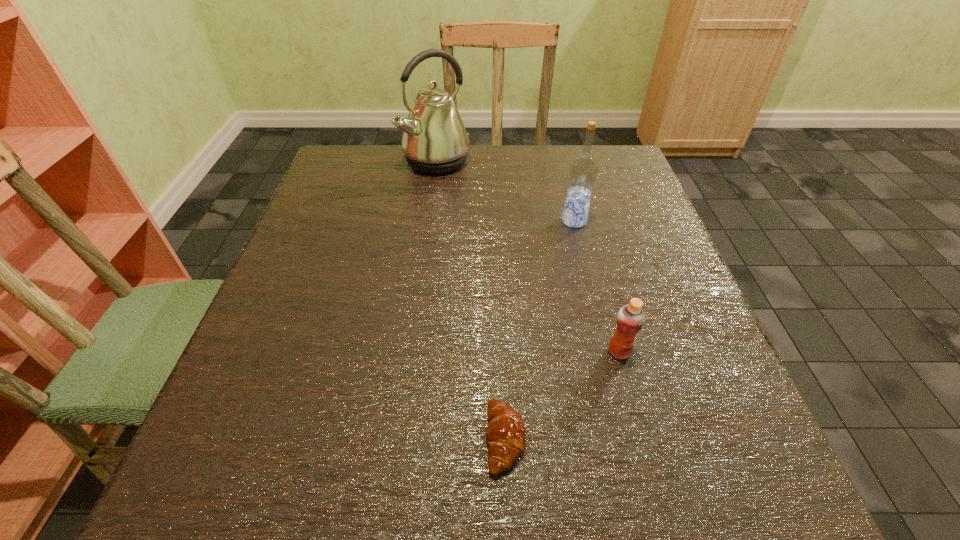
At what (x,y) coordinates should I click in order to perform the action: click on the tallest object. Please return your answer as a coordinate pair (x, y). The height and width of the screenshot is (540, 960). Looking at the image, I should click on (435, 141).

Identify the location of the farthest object. The height and width of the screenshot is (540, 960). (435, 141).

The height and width of the screenshot is (540, 960). Find the location of `the second tallest object`. the second tallest object is located at coordinates (583, 169).

Where is `the second farthest object`? the second farthest object is located at coordinates (583, 169).

Identify the location of the second nearest object. This screenshot has width=960, height=540. (630, 319).

Image resolution: width=960 pixels, height=540 pixels. What are the coordinates of `the second shortest object` in the screenshot? It's located at (630, 319).

This screenshot has height=540, width=960. I want to click on the third object from right to left, so click(505, 433).

The width and height of the screenshot is (960, 540). What are the coordinates of `crescent roll` in the screenshot? It's located at (505, 433).

You are a GUI agent. You are given a task and a screenshot of the screen. Output one action in this format:
    pyautogui.click(x=<x>, y=<y>)
    Task: Click on the vacant space positioned 0.080m on the right of the kettle
    
    Given the screenshot: What is the action you would take?
    tap(500, 161)

The width and height of the screenshot is (960, 540). Identify the location of free space located on the front of the second farthest object. (600, 327).